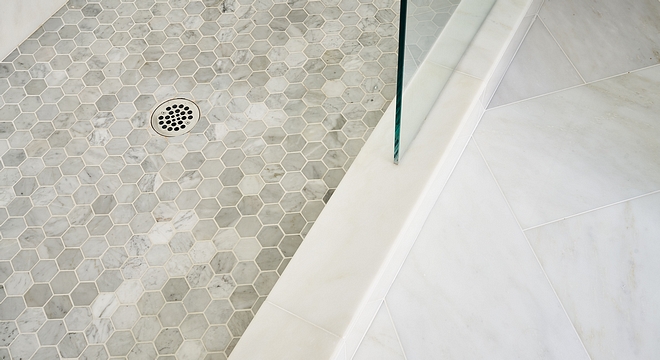
The image size is (660, 360). Find the location of `left side of glass door`. left side of glass door is located at coordinates (401, 25).